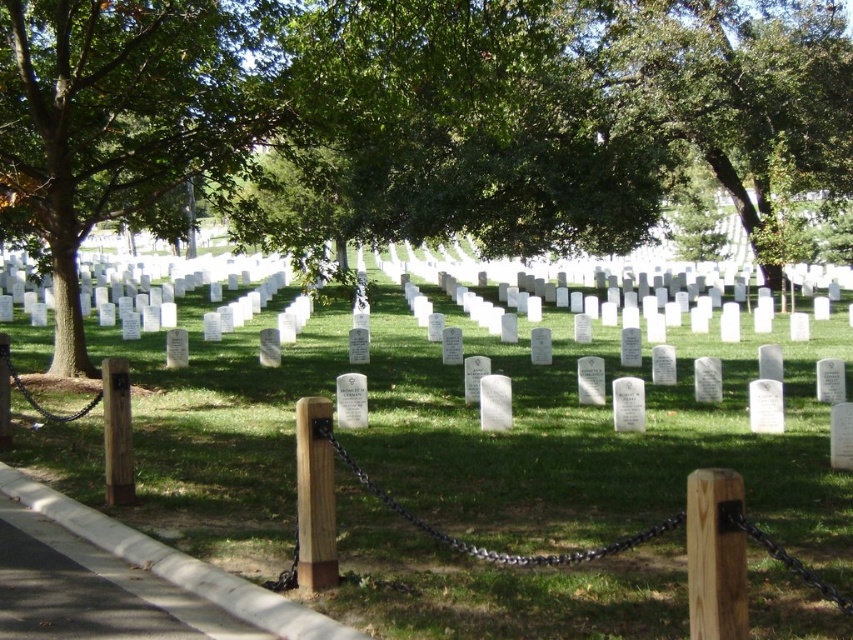
You are standing at the entrance of the cemetery and see two points marked in the image. The first point is at coordinate point (291, 483) and the second is at point (753, 202). If you were to walk directly towards the second point, would you pass by the first point before reaching it?

Point (291, 483) is in front of point (753, 202), so yes, you would pass by the first point before reaching the second point.

You are standing at the entrance of the cemetery and see the point marked at coordinates (410,116). What object is located at that point?

The green leafy tree at center is located at point (410,116).

You are standing at the entrance of the cemetery and see the green leafy tree at center and the green leafy tree at upper center. Which tree is closer to the pathway?

The green leafy tree at center is closer to the pathway because it is positioned under the green leafy tree at upper center, indicating it is in front and nearer to the observer.